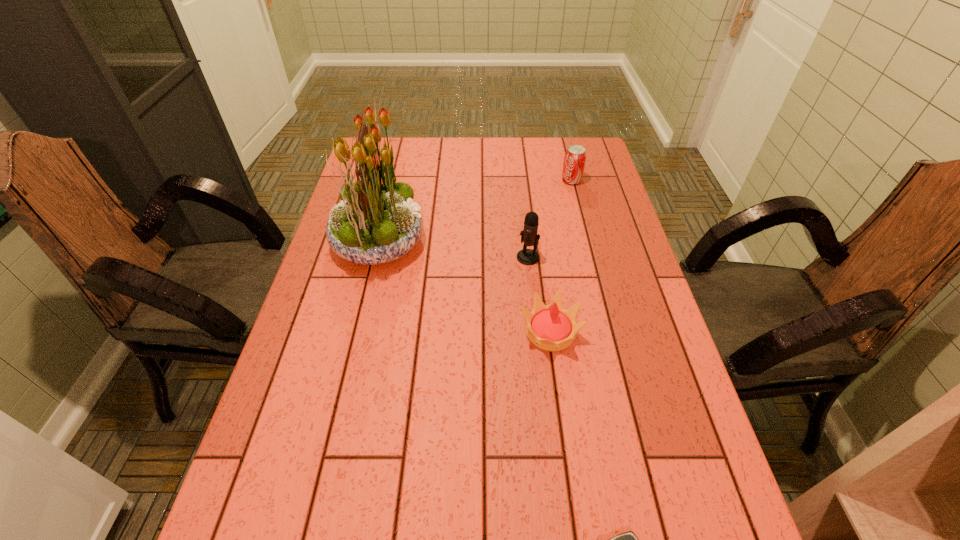
At what (x,y) coordinates should I click in order to perform the action: click on object situated at the left edge. Please return your answer as a coordinate pair (x, y). The width and height of the screenshot is (960, 540). Looking at the image, I should click on (376, 222).

Where is `object that is at the right edge`? This screenshot has height=540, width=960. object that is at the right edge is located at coordinates (575, 157).

In the image, there is a desktop. In order to click on vacant space at the far edge in this screenshot , I will do (502, 161).

At what (x,y) coordinates should I click in order to perform the action: click on free space at the left edge. Please return your answer as a coordinate pair (x, y). The width and height of the screenshot is (960, 540). Looking at the image, I should click on (300, 328).

At what (x,y) coordinates should I click in order to perform the action: click on vacant space at the right edge of the desktop. Please return your answer as a coordinate pair (x, y). The image size is (960, 540). Looking at the image, I should click on (627, 399).

Locate an element on the screen. The width and height of the screenshot is (960, 540). vacant space at the far right corner is located at coordinates (582, 138).

Where is `free spot between the leftmost object and the microphone`? This screenshot has width=960, height=540. free spot between the leftmost object and the microphone is located at coordinates (453, 249).

At what (x,y) coordinates should I click in order to perform the action: click on free spot between the second tallest object and the farthest object. Please return your answer as a coordinate pair (x, y). Looking at the image, I should click on (550, 219).

Image resolution: width=960 pixels, height=540 pixels. Identify the location of free space between the fourth farthest object and the microphone. click(540, 294).

I want to click on empty location between the microphone and the crown, so click(540, 294).